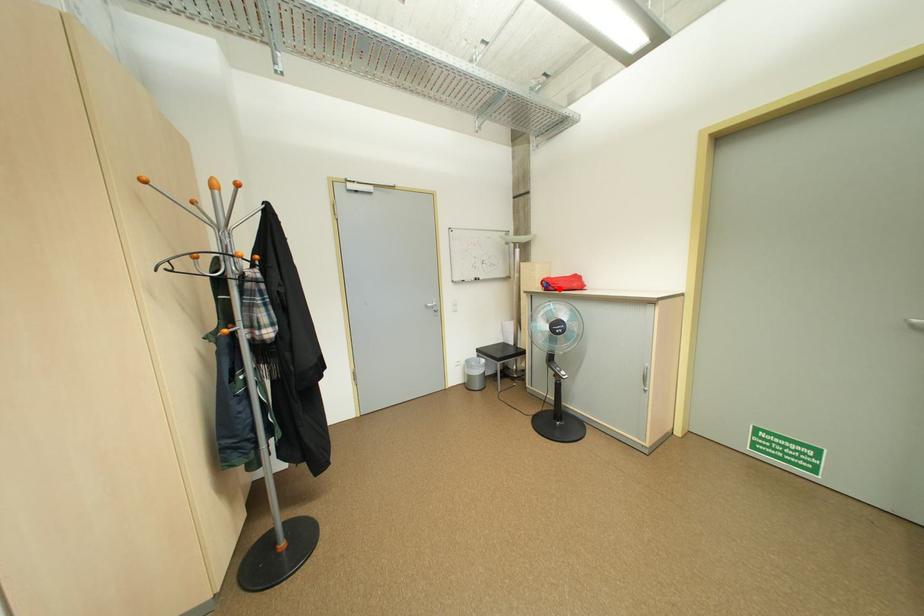
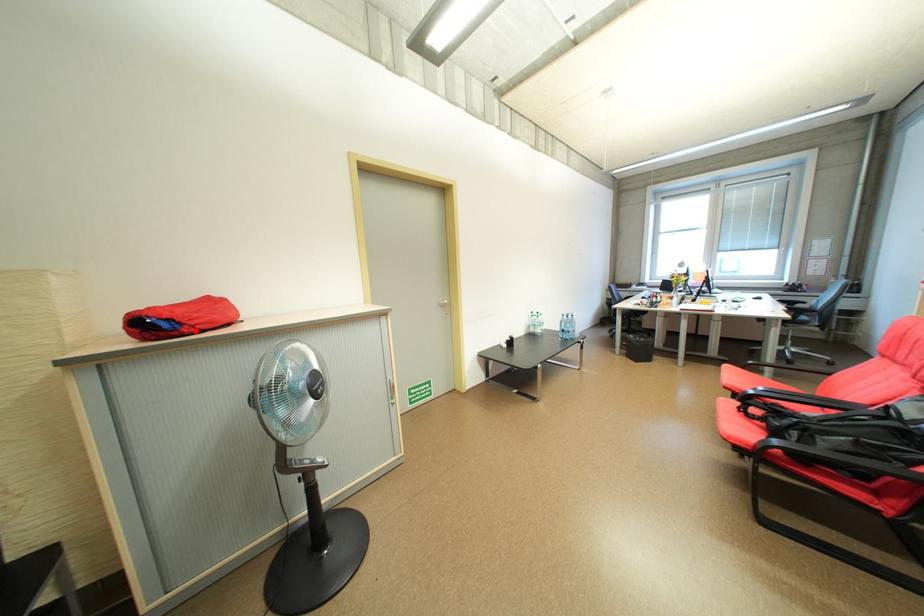
I am providing you with two images of the same scene from different viewpoints. A red point is marked on the first image and another point is marked on the second image. Is the red point in image1 aligned with the point shown in image2?

Yes